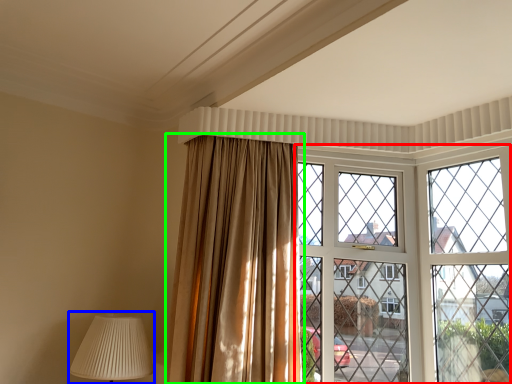
Question: Which object is the closest to the window (highlighted by a red box)? Choose among these: table lamp (highlighted by a blue box) or curtain (highlighted by a green box).

Choices:
 (A) table lamp
 (B) curtain

Answer: (B)